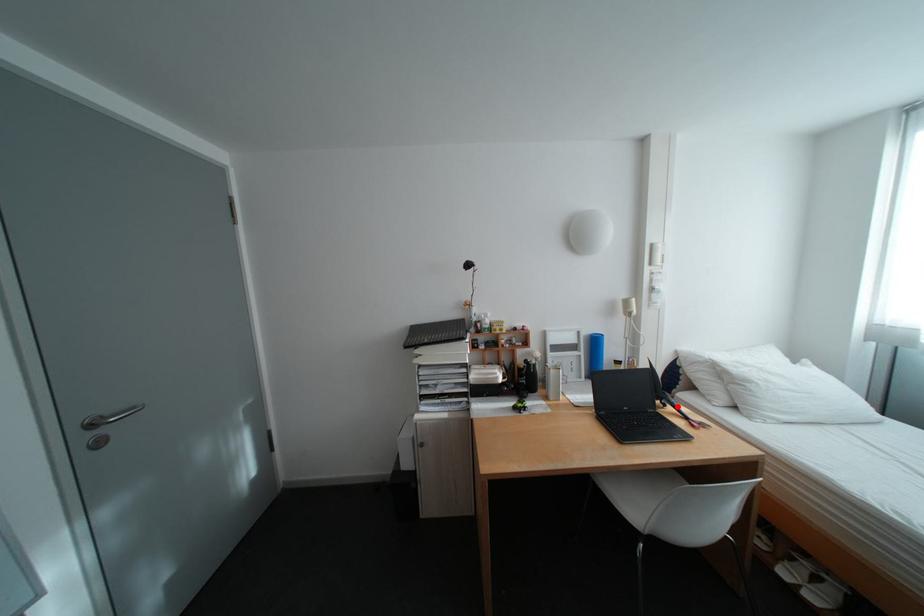
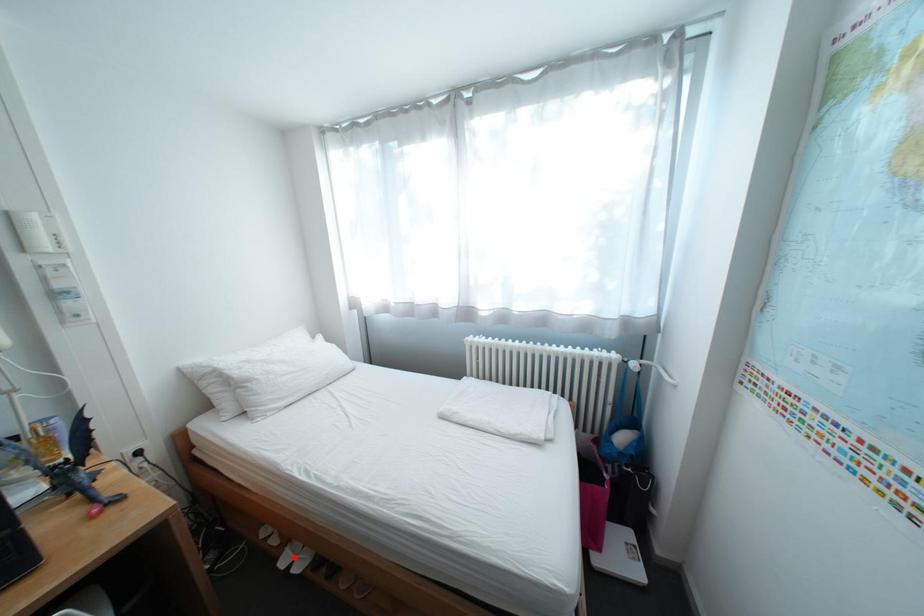
I am providing you with two images of the same scene from different viewpoints. A red point is marked on the first image and another point is marked on the second image. Do the highlighted points in image1 and image2 indicate the same real-world spot?

No